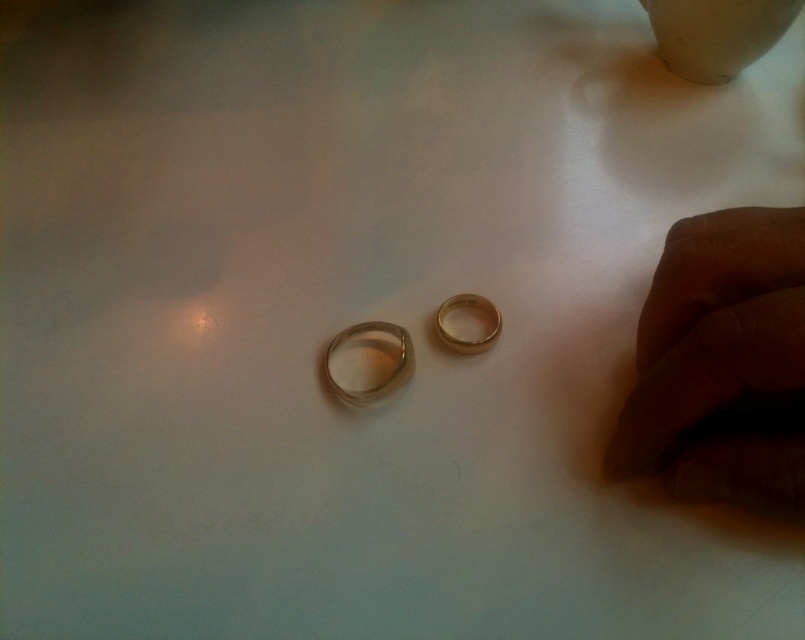
Does matte gold ring at center lie behind gold shiny ring at center?

No, it is not.

Does matte gold ring at center have a greater height compared to gold shiny ring at center?

Yes, matte gold ring at center is taller than gold shiny ring at center.

Does point (753, 496) come in front of point (477, 339)?

That is True.

Find the location of `matte gold ring at center`. matte gold ring at center is located at coordinates (719, 360).

Can you confirm if matte gold ring at center is positioned below polished gold ring at center?

Actually, matte gold ring at center is above polished gold ring at center.

Can you confirm if matte gold ring at center is smaller than polished gold ring at center?

Actually, matte gold ring at center might be larger than polished gold ring at center.

Which is in front, point (682, 336) or point (337, 388)?

Point (682, 336)

Find the location of a particular element. matte gold ring at center is located at coordinates (719, 360).

Does polished gold ring at center have a smaller size compared to gold shiny ring at center?

Incorrect, polished gold ring at center is not smaller in size than gold shiny ring at center.

Who is lower down, polished gold ring at center or gold shiny ring at center?

polished gold ring at center is below.

This screenshot has width=805, height=640. What are the coordinates of `polished gold ring at center` in the screenshot? It's located at [389, 374].